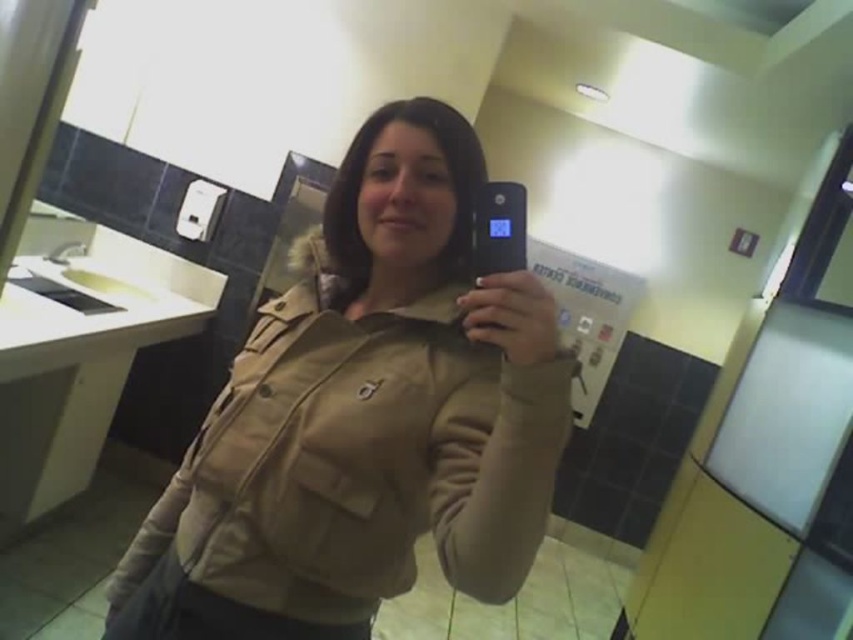
Which is in front, point (79, 275) or point (489, 182)?

Point (489, 182)

Does white glossy sink at left come behind black plastic phone at center?

Yes.

Where is `white glossy sink at left`? The image size is (853, 640). white glossy sink at left is located at coordinates (96, 296).

Is matte khaki jacket at center behind white glossy sink at left?

That is False.

Is point (483, 442) farther from viewer compared to point (67, 324)?

No, it is in front of (67, 324).

Image resolution: width=853 pixels, height=640 pixels. In order to click on matte khaki jacket at center in this screenshot , I will do `click(364, 417)`.

Between matte khaki jacket at center and black plastic phone at center, which one has more height?

matte khaki jacket at center

Is matte khaki jacket at center further to the viewer compared to black plastic phone at center?

No, it is in front of black plastic phone at center.

Which is behind, point (259, 376) or point (474, 252)?

The point (259, 376) is more distant.

At what (x,y) coordinates should I click in order to perform the action: click on matte khaki jacket at center. Please return your answer as a coordinate pair (x, y). This screenshot has height=640, width=853. Looking at the image, I should click on (364, 417).